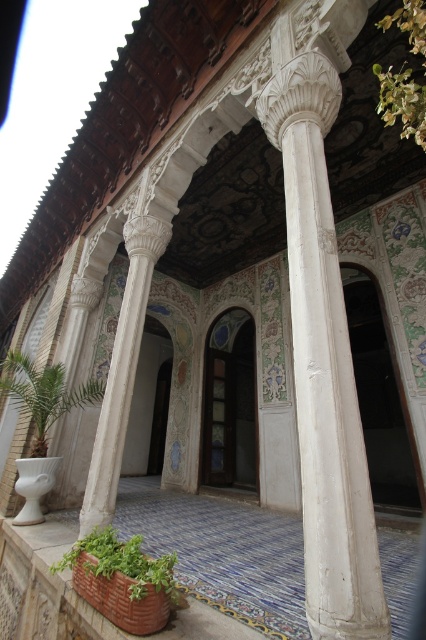
Question: Is white marble column at center to the right of green leafy plant at upper right from the viewer's perspective?

Choices:
 (A) yes
 (B) no

Answer: (B)

Question: Which object appears closest to the camera in this image?

Choices:
 (A) green leafy plant at lower left
 (B) white marble column at center
 (C) green leafy plant in terracotta pot at lower left
 (D) terracotta clay pot at lower center

Answer: (B)

Question: Does white marble column at center have a larger size compared to terracotta clay pot at lower center?

Choices:
 (A) no
 (B) yes

Answer: (B)

Question: Which point appears farthest from the camera in this image?

Choices:
 (A) (92, 547)
 (B) (405, 6)
 (C) (48, 372)
 (D) (325, 266)

Answer: (C)

Question: Which object is the closest to the terracotta clay pot at lower center?

Choices:
 (A) white marble column at center
 (B) green leafy plant at upper right
 (C) green leafy plant at lower left

Answer: (C)

Question: Does white marble column at center appear under green leafy plant at lower left?

Choices:
 (A) yes
 (B) no

Answer: (B)